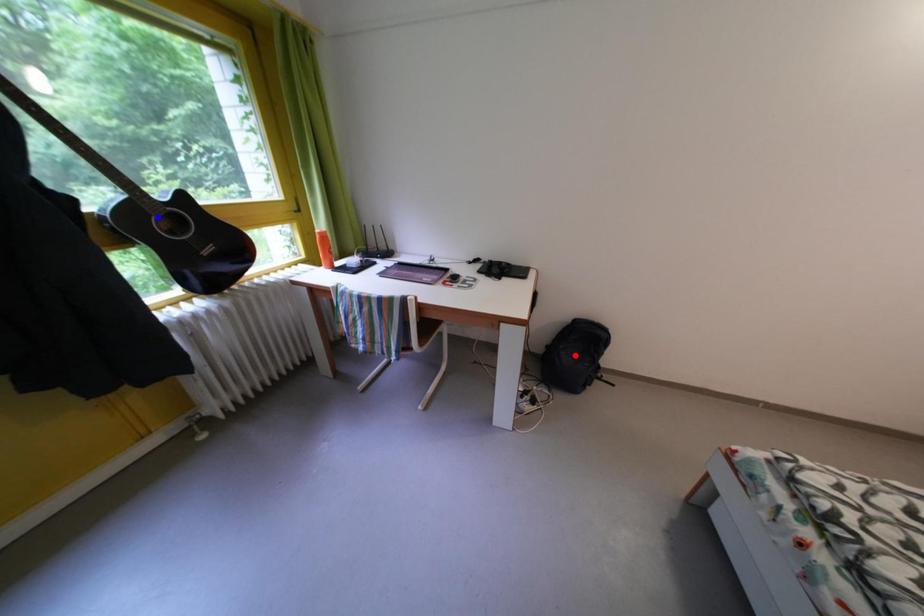
Question: In the image, two points are highlighted. Which point is nearer to the camera? Reply with the corresponding letter.

Choices:
 (A) blue point
 (B) red point

Answer: (A)